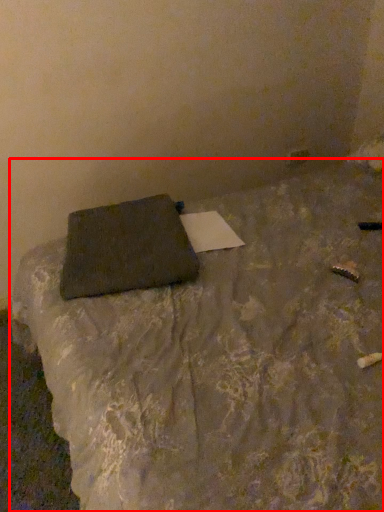
Question: In this image, where is furniture (annotated by the red box) located relative to pillow?

Choices:
 (A) left
 (B) right

Answer: (B)